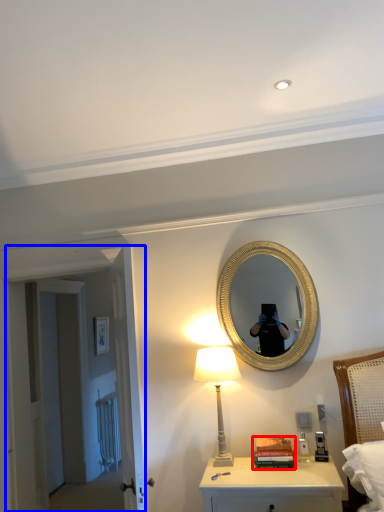
Question: Which point is further to the camera, book (highlighted by a red box) or door (highlighted by a blue box)?

Choices:
 (A) book
 (B) door

Answer: (B)